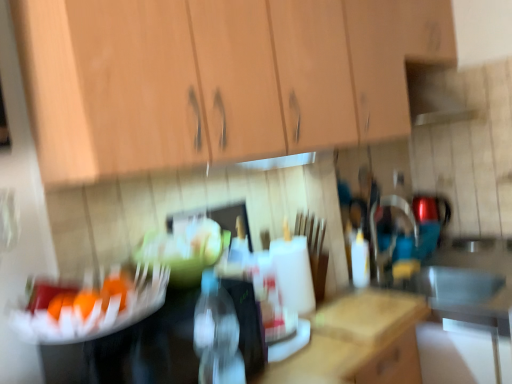
Question: Considering the relative sizes of orange matte fruit at center and white plastic bottle at center, which appears as the first bottle when viewed from the back, in the image provided, is orange matte fruit at center wider than white plastic bottle at center, which appears as the first bottle when viewed from the back,?

Choices:
 (A) yes
 (B) no

Answer: (B)

Question: From a real-world perspective, is orange matte fruit at center on white plastic bottle at center, the first bottle when ordered from right to left?

Choices:
 (A) no
 (B) yes

Answer: (B)

Question: Would you say white plastic bottle at center, arranged as the 2th bottle when viewed from the front, is part of orange matte fruit at center's contents?

Choices:
 (A) no
 (B) yes

Answer: (A)

Question: Is the position of orange matte fruit at center more distant than that of white plastic bottle at center, arranged as the 2th bottle when viewed from the left?

Choices:
 (A) no
 (B) yes

Answer: (A)

Question: Is orange matte fruit at center to the left of white plastic bottle at center, the first bottle when ordered from right to left, from the viewer's perspective?

Choices:
 (A) yes
 (B) no

Answer: (A)

Question: In the image, is transparent plastic bottle at center, the second bottle positioned from the back, positioned in front of or behind white plastic bottle at center, arranged as the 2th bottle when viewed from the left?

Choices:
 (A) front
 (B) behind

Answer: (A)

Question: Is transparent plastic bottle at center, positioned as the first bottle in left-to-right order, to the left or to the right of white plastic bottle at center, arranged as the 2th bottle when viewed from the front, in the image?

Choices:
 (A) right
 (B) left

Answer: (B)

Question: From the image's perspective, is transparent plastic bottle at center, the second bottle from the right, located above or below white plastic bottle at center, arranged as the 2th bottle when viewed from the front?

Choices:
 (A) below
 (B) above

Answer: (A)

Question: Is transparent plastic bottle at center, the second bottle from the right, wider or thinner than white plastic bottle at center, which appears as the first bottle when viewed from the back?

Choices:
 (A) wide
 (B) thin

Answer: (A)

Question: From a real-world perspective, relative to wooden cabinet at upper center, is white plastic bottle at center, arranged as the 2th bottle when viewed from the front, vertically above or below?

Choices:
 (A) above
 (B) below

Answer: (B)

Question: Is point (360, 253) closer or farther from the camera than point (26, 59)?

Choices:
 (A) closer
 (B) farther

Answer: (B)

Question: In the image, is white plastic bottle at center, arranged as the 2th bottle when viewed from the front, on the left side or the right side of wooden cabinet at upper center?

Choices:
 (A) right
 (B) left

Answer: (A)

Question: From their relative heights in the image, would you say white plastic bottle at center, arranged as the 2th bottle when viewed from the left, is taller or shorter than wooden cabinet at upper center?

Choices:
 (A) tall
 (B) short

Answer: (B)

Question: Is white plastic bottle at center, which appears as the first bottle when viewed from the back, taller or shorter than transparent plastic bottle at center, positioned as the first bottle in left-to-right order?

Choices:
 (A) tall
 (B) short

Answer: (B)

Question: Considering the positions of white plastic bottle at center, arranged as the 2th bottle when viewed from the left, and transparent plastic bottle at center, the second bottle from the right, in the image, is white plastic bottle at center, arranged as the 2th bottle when viewed from the left, wider or thinner than transparent plastic bottle at center, the second bottle from the right,?

Choices:
 (A) thin
 (B) wide

Answer: (A)